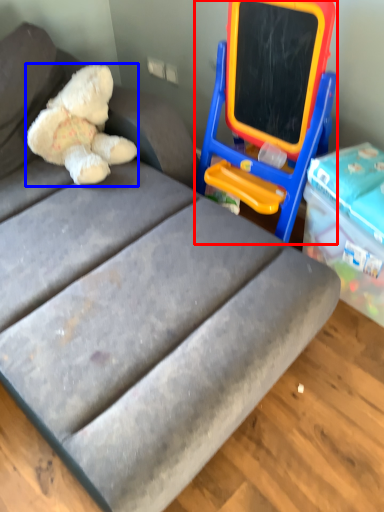
Question: Which object appears closest to the camera in this image, equipment (highlighted by a red box) or teddy bear (highlighted by a blue box)?

Choices:
 (A) equipment
 (B) teddy bear

Answer: (A)